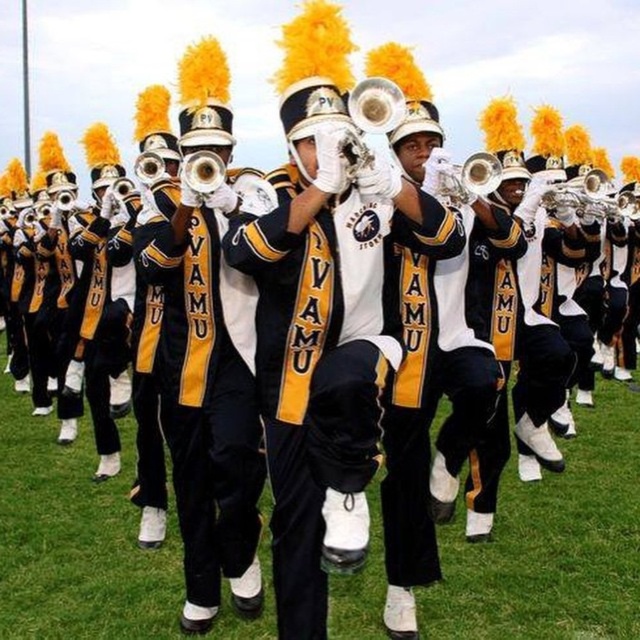
You are a photographer trying to capture the band members in their uniforms and instruments. Based on the scene, which object is located below the other between the black matte uniform at center and the matte brass trumpet at center?

The black matte uniform at center is positioned under the matte brass trumpet at center, so the uniform is below the trumpet.

You are a photographer trying to capture the entire marching band in a single shot. You notice a black matte uniform at center located at point (x=205, y=397). Can you estimate whether the entire marching band will fit in your camera frame if you focus on this point?

The black matte uniform at center is located at point (x=205, y=397). Since this point is at the center of the image, focusing here should allow the entire marching band to fit within the camera frame, assuming standard framing techniques are used.

You are a member of the marching band in the image. You are currently standing at point (189, 154) and need to move to point (244, 563). Given that the band is marching forward in formation, will you have to move forward or backward to reach your destination?

Point (244, 563) is behind point (189, 154), so you will have to move backward to reach your destination.